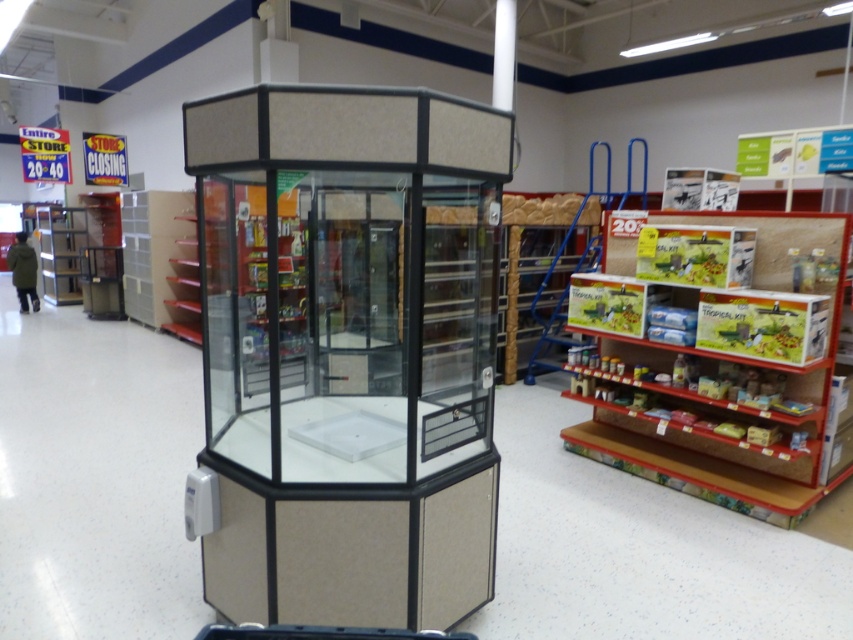
Question: Which of the following is the closest to the observer?

Choices:
 (A) (461, 586)
 (B) (22, 284)
 (C) (679, 454)

Answer: (A)

Question: Where is wooden textured shelf at right located in relation to green matte jacket at left in the image?

Choices:
 (A) above
 (B) below

Answer: (B)

Question: Does matte glass display case at center appear under green matte jacket at left?

Choices:
 (A) no
 (B) yes

Answer: (B)

Question: Considering the real-world distances, which object is closest to the wooden textured shelf at right?

Choices:
 (A) matte glass display case at center
 (B) green matte jacket at left

Answer: (A)

Question: Considering the real-world distances, which object is closest to the matte glass display case at center?

Choices:
 (A) wooden textured shelf at right
 (B) green matte jacket at left

Answer: (A)

Question: Does matte glass display case at center have a larger size compared to green matte jacket at left?

Choices:
 (A) yes
 (B) no

Answer: (A)